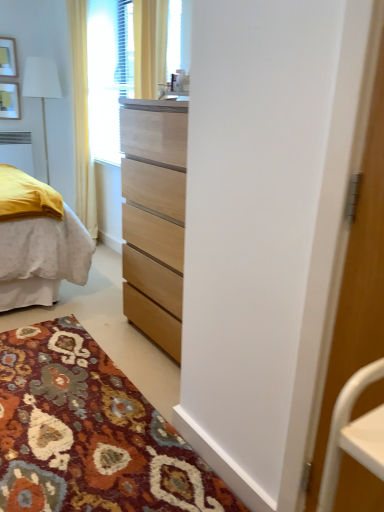
Question: Is yellow fabric curtain at upper left oriented towards white fabric lampshade at left?

Choices:
 (A) yes
 (B) no

Answer: (B)

Question: Considering the relative sizes of yellow fabric curtain at upper left and white fabric lampshade at left in the image provided, is yellow fabric curtain at upper left taller than white fabric lampshade at left?

Choices:
 (A) yes
 (B) no

Answer: (A)

Question: Does yellow fabric curtain at upper left have a smaller size compared to white fabric lampshade at left?

Choices:
 (A) no
 (B) yes

Answer: (A)

Question: Considering the relative positions of yellow fabric curtain at upper left and white fabric lampshade at left in the image provided, is yellow fabric curtain at upper left to the left of white fabric lampshade at left from the viewer's perspective?

Choices:
 (A) yes
 (B) no

Answer: (B)

Question: From the image's perspective, would you say yellow fabric curtain at upper left is positioned over white fabric lampshade at left?

Choices:
 (A) yes
 (B) no

Answer: (B)

Question: Is yellow fabric curtain at upper left wider or thinner than white plastic radiator at left?

Choices:
 (A) thin
 (B) wide

Answer: (B)

Question: From a real-world perspective, relative to white plastic radiator at left, is yellow fabric curtain at upper left vertically above or below?

Choices:
 (A) above
 (B) below

Answer: (A)

Question: Would you say yellow fabric curtain at upper left is inside or outside white plastic radiator at left?

Choices:
 (A) inside
 (B) outside

Answer: (B)

Question: From the image's perspective, is yellow fabric curtain at upper left above or below white plastic radiator at left?

Choices:
 (A) above
 (B) below

Answer: (A)

Question: From a real-world perspective, relative to wooden picture frame at upper left, placed as the 2th picture frame when sorted from top to bottom, is white plastic radiator at left vertically above or below?

Choices:
 (A) below
 (B) above

Answer: (A)

Question: Considering the positions of white plastic radiator at left and wooden picture frame at upper left, placed as the 2th picture frame when sorted from top to bottom, in the image, is white plastic radiator at left wider or thinner than wooden picture frame at upper left, placed as the 2th picture frame when sorted from top to bottom,?

Choices:
 (A) thin
 (B) wide

Answer: (B)

Question: Is white plastic radiator at left bigger or smaller than wooden picture frame at upper left, placed as the 2th picture frame when sorted from top to bottom?

Choices:
 (A) big
 (B) small

Answer: (A)

Question: Relative to wooden picture frame at upper left, placed as the 2th picture frame when sorted from top to bottom, is white plastic radiator at left in front or behind?

Choices:
 (A) front
 (B) behind

Answer: (B)

Question: Is yellow fabric curtain at upper left inside the boundaries of wooden picture frame at upper left, the first picture frame when ordered from bottom to top, or outside?

Choices:
 (A) inside
 (B) outside

Answer: (B)

Question: Does point (87, 210) appear closer or farther from the camera than point (1, 117)?

Choices:
 (A) closer
 (B) farther

Answer: (A)